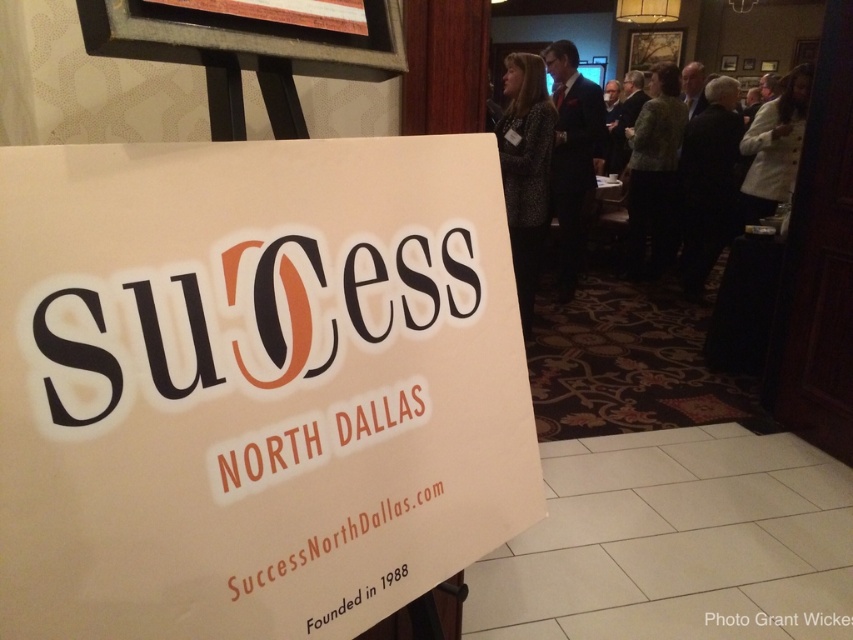
You are standing in front of the large signboard with the text Success North Dallas. You need to place a white paper sign at center somewhere on the signboard. According to the coordinates provided, where should you place it?

The white paper sign at center should be placed at point (253, 385) on the signboard.

Consider the image. You are standing in front of the signboard and want to greet the person wearing the dark suit at upper right. In which direction should you look relative to the signboard?

The dark suit at upper right is located at point 0.244 on the horizontal axis and 0.672 on the vertical axis relative to the signboard. To greet them, you should look to the upper right direction relative to the signboard.